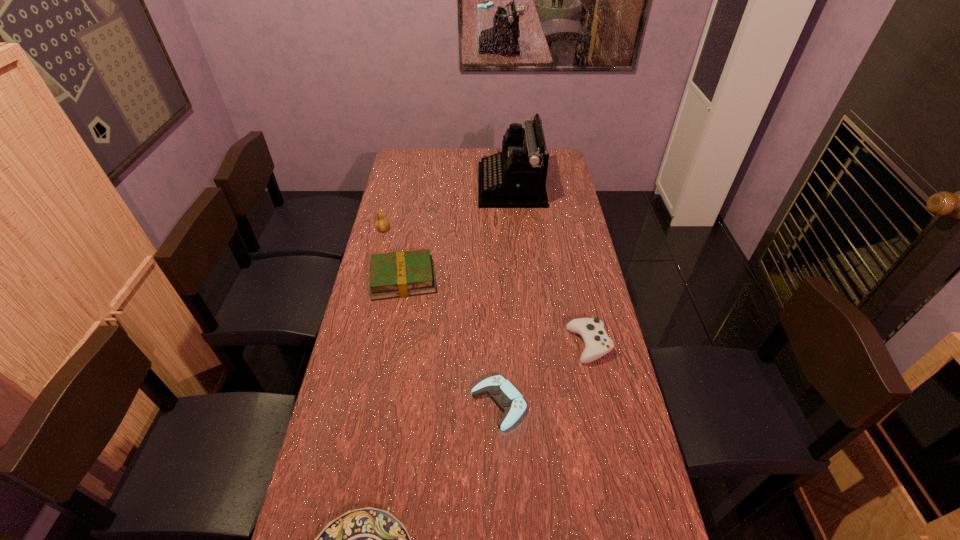
In order to click on control that is positioned at the right edge in this screenshot , I will do `click(597, 343)`.

Where is `object that is at the far right corner`? This screenshot has width=960, height=540. object that is at the far right corner is located at coordinates (516, 177).

In the image, there is a desktop. At what (x,y) coordinates should I click in order to perform the action: click on blank space at the left edge. Please return your answer as a coordinate pair (x, y). This screenshot has width=960, height=540. Looking at the image, I should click on (393, 344).

The width and height of the screenshot is (960, 540). Identify the location of free space at the right edge of the desktop. (545, 234).

This screenshot has height=540, width=960. What are the coordinates of `vacant point at the far right corner` in the screenshot? It's located at (561, 152).

The image size is (960, 540). I want to click on vacant area that lies between the right control and the second nearest object, so click(544, 374).

Image resolution: width=960 pixels, height=540 pixels. I want to click on empty space that is in between the fifth farthest object and the second tallest object, so (442, 317).

Find the location of a particular element. This screenshot has width=960, height=540. free space between the typewriter and the fifth farthest object is located at coordinates (505, 295).

I want to click on vacant space that's between the farther control and the farthest object, so click(x=550, y=265).

Where is `free point between the left control and the fifth nearest object`? free point between the left control and the fifth nearest object is located at coordinates (442, 317).